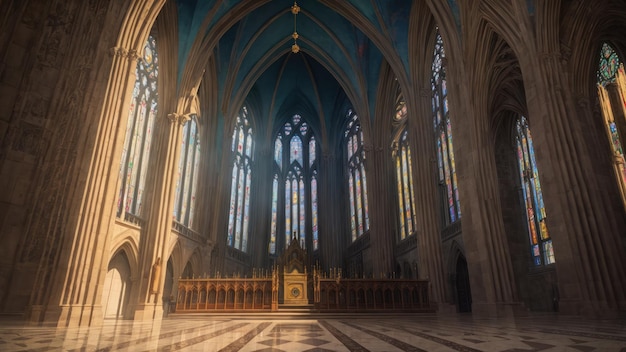
The height and width of the screenshot is (352, 626). Find the location of `vertical floor lines`. vertical floor lines is located at coordinates (245, 339), (337, 338), (190, 344), (149, 338), (379, 339), (168, 351).